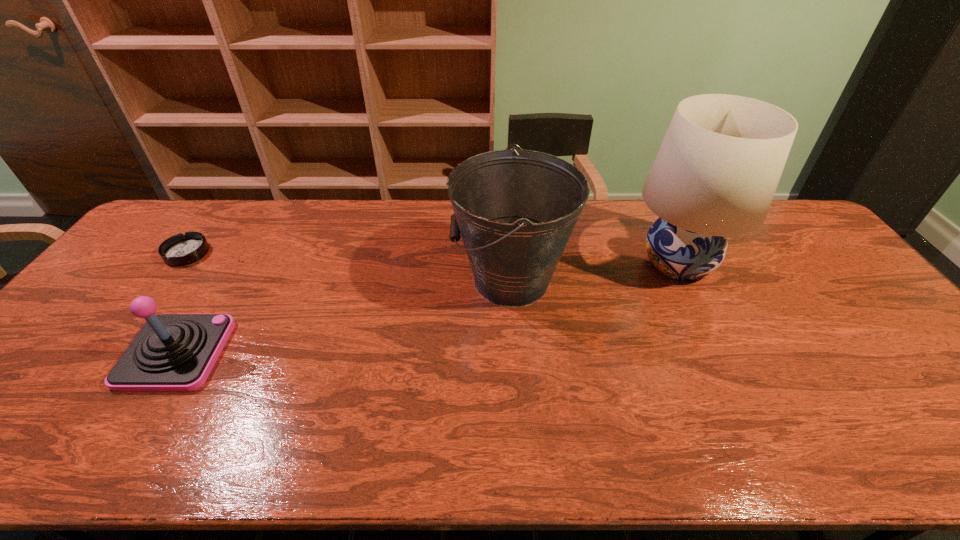
At what (x,y) coordinates should I click in order to perform the action: click on vacant space at the left edge of the desktop. Please return your answer as a coordinate pair (x, y). The width and height of the screenshot is (960, 540). Looking at the image, I should click on (156, 269).

The image size is (960, 540). In the image, there is a desktop. Identify the location of vacant area at the right edge. (887, 341).

At what (x,y) coordinates should I click in order to perform the action: click on vacant space at the far right corner of the desktop. Please return your answer as a coordinate pair (x, y). The height and width of the screenshot is (540, 960). Looking at the image, I should click on (766, 225).

Identify the location of empty space between the third tallest object and the second tallest object. The height and width of the screenshot is (540, 960). (344, 316).

What are the coordinates of `unoccupied area between the rightmost object and the shortest object` in the screenshot? It's located at (432, 258).

At what (x,y) coordinates should I click in order to perform the action: click on empty space that is in between the joystick and the tallest object. Please return your answer as a coordinate pair (x, y). Looking at the image, I should click on (427, 308).

Identify the location of vacant area that lies between the second object from right to left and the shortest object. The image size is (960, 540). (349, 267).

This screenshot has width=960, height=540. What are the coordinates of `free area in between the third object from left to right and the joystick` in the screenshot? It's located at (344, 316).

The width and height of the screenshot is (960, 540). I want to click on free space between the third object from left to right and the third tallest object, so click(x=344, y=316).

You are a GUI agent. You are given a task and a screenshot of the screen. Output one action in this format:
    pyautogui.click(x=<x>, y=<y>)
    Task: Click on the free space between the shortest object and the bucket
    Image resolution: width=960 pixels, height=540 pixels.
    Given the screenshot: What is the action you would take?
    pyautogui.click(x=349, y=267)